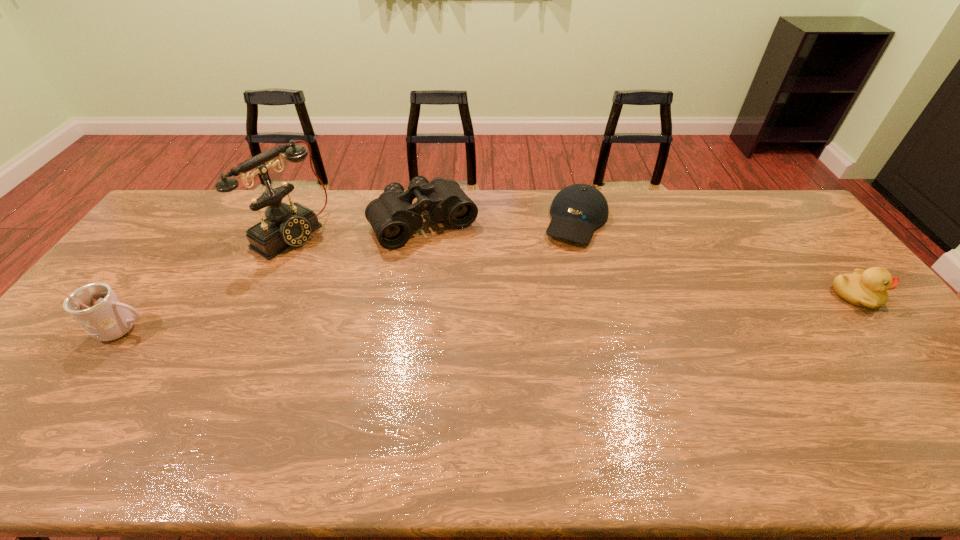
Image resolution: width=960 pixels, height=540 pixels. I want to click on telephone that is positioned at the far edge, so click(x=285, y=225).

Image resolution: width=960 pixels, height=540 pixels. Identify the location of baseball cap at the far edge. (577, 210).

Locate an element on the screen. object that is positioned at the left edge is located at coordinates (96, 307).

Find the location of a particular element. object that is at the right edge is located at coordinates (867, 288).

At what (x,y) coordinates should I click in order to perform the action: click on blank space at the far edge of the desktop. Please return your answer as a coordinate pair (x, y). The width and height of the screenshot is (960, 540). Looking at the image, I should click on (673, 191).

In the image, there is a desktop. What are the coordinates of `vacant space at the near edge` in the screenshot? It's located at (647, 386).

Image resolution: width=960 pixels, height=540 pixels. I want to click on vacant region at the left edge of the desktop, so click(x=81, y=382).

Identify the location of blank space at the right edge. pyautogui.click(x=801, y=250).

The width and height of the screenshot is (960, 540). What are the coordinates of `free location at the far left corner` in the screenshot? It's located at (195, 202).

The height and width of the screenshot is (540, 960). Identify the location of free space at the far right corner. (734, 190).